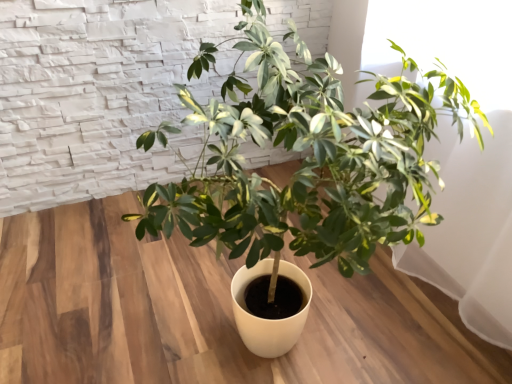
This screenshot has height=384, width=512. What are the coordinates of `free region under green matte plant at center (from a real-world perspective)` in the screenshot? It's located at (314, 314).